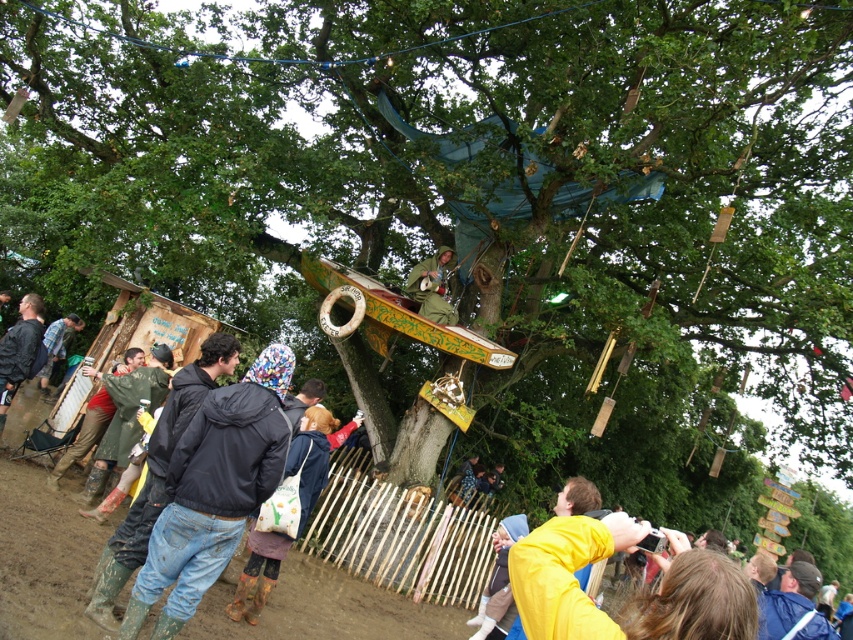
Question: Based on their relative distances, which object is farther from the rubber boots at lower left?

Choices:
 (A) wet rubber boots at lower left
 (B) wooden at center
 (C) ripped denim jacket at lower left
 (D) denim jacket at lower left

Answer: (A)

Question: Which object is closer to the camera taking this photo?

Choices:
 (A) green matte jacket at center
 (B) denim jacket at lower left
 (C) rubber boots at lower left
 (D) green rubber boots at lower left

Answer: (C)

Question: Does rubber boots at lower left lie in front of black matte jacket at left?

Choices:
 (A) yes
 (B) no

Answer: (A)

Question: Where is denim jacket at lower left located in relation to ripped denim jacket at lower left in the image?

Choices:
 (A) below
 (B) above

Answer: (A)

Question: Estimate the real-world distances between objects in this image. Which object is farther from the black matte jacket at left?

Choices:
 (A) ripped denim jacket at lower left
 (B) green rubber boots at lower left

Answer: (B)

Question: Does green matte jacket at center have a smaller size compared to green rubber boots at lower left?

Choices:
 (A) yes
 (B) no

Answer: (B)